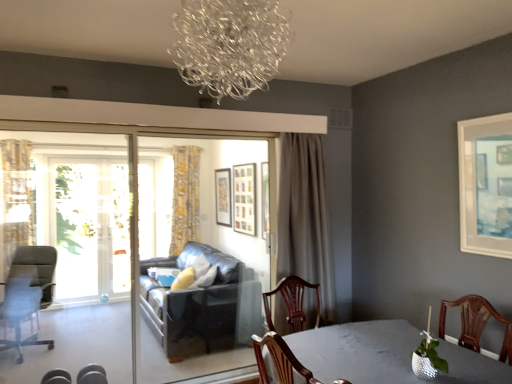
Question: Relative to matte black chair at lower left, the 1th chair from the front, is gray fabric curtain at center, positioned as the 3th curtain in back-to-front order, in front or behind?

Choices:
 (A) front
 (B) behind

Answer: (B)

Question: In terms of width, does gray fabric curtain at center, placed as the first curtain when sorted from front to back, look wider or thinner when compared to matte black chair at lower left, which is counted as the 2th chair, starting from the left?

Choices:
 (A) wide
 (B) thin

Answer: (A)

Question: Which of these objects is positioned closest to the leather couch at center?

Choices:
 (A) matte black picture frame at center, which is counted as the 1th picture frame, starting from the left
 (B) clear glass chandelier at upper center
 (C) transparent glass screen door at left, which is counted as the 2th screen door, starting from the left
 (D) white matte picture frame at upper right, the first picture frame in the front-to-back sequence
 (E) yellow floral fabric curtain at left, which appears as the second curtain when viewed from the back

Answer: (C)

Question: Estimate the real-world distances between objects in this image. Which object is farther from the black leather couch at center, acting as the 3th screen door starting from the left?

Choices:
 (A) clear glass chandelier at upper center
 (B) wooden picture frame at center, which is the 2th picture frame from left to right
 (C) shiny gray table at lower right
 (D) wooden picture frame at center, which ranks as the 2th picture frame in right-to-left order
 (E) metallic silver chair at lower left, the 2th chair from the back

Answer: (A)